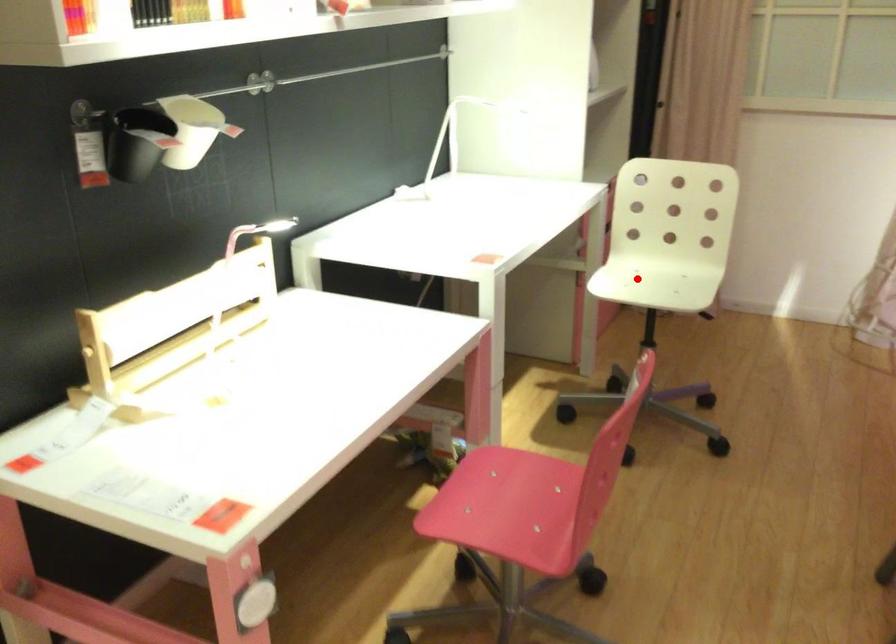
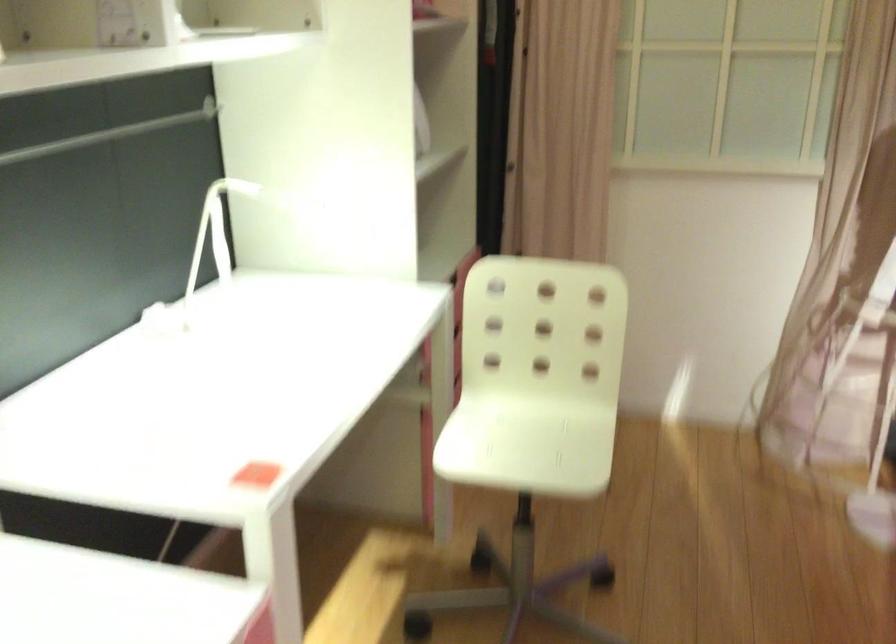
Where in the second image is the point corresponding to the highlighted location from the first image?

(495, 431)